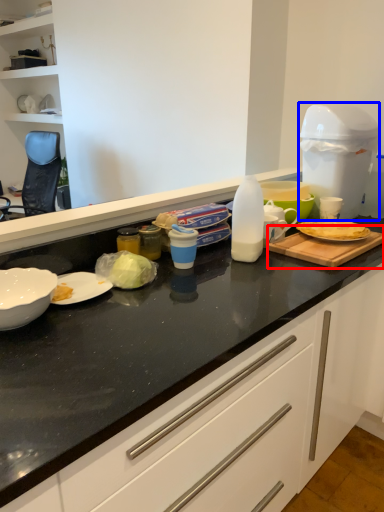
Question: Which object appears farthest to the camera in this image, cutting board (highlighted by a red box) or appliance (highlighted by a blue box)?

Choices:
 (A) cutting board
 (B) appliance

Answer: (B)